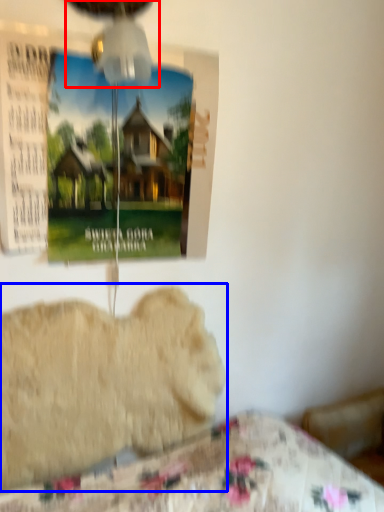
Question: Which of the following is the farthest to the observer, mechanical fan (highlighted by a red box) or animal (highlighted by a blue box)?

Choices:
 (A) mechanical fan
 (B) animal

Answer: (B)